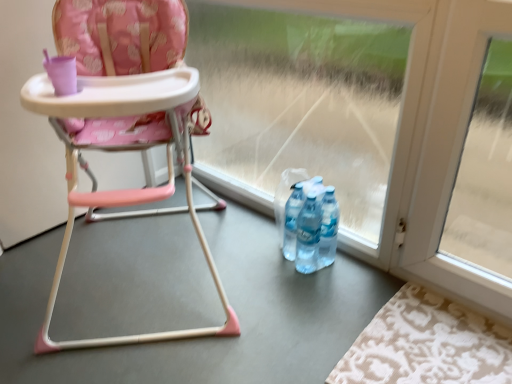
The height and width of the screenshot is (384, 512). I want to click on vacant point above beige damask rug at lower right (from a real-world perspective), so click(405, 352).